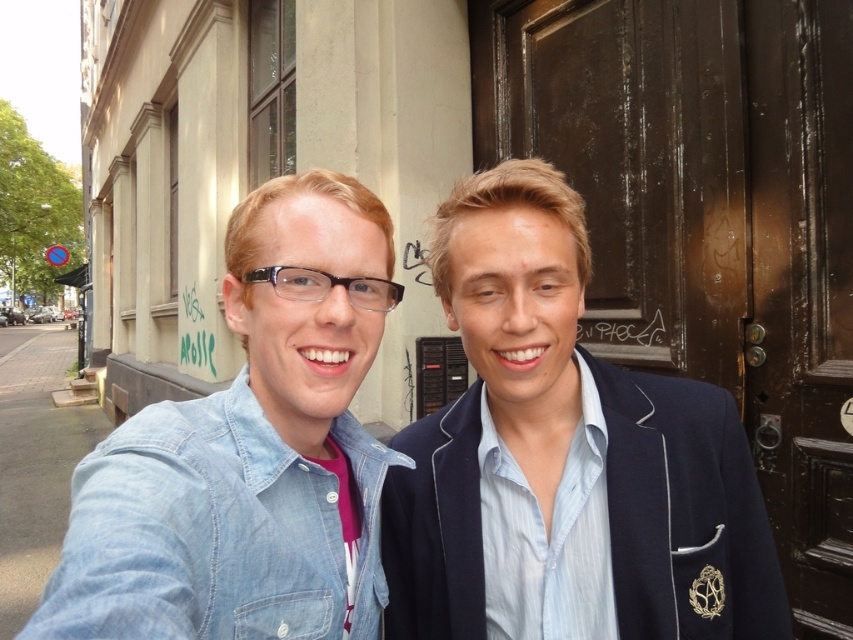
Does denim jacket at center have a greater width compared to denim jacket at lower left?

Indeed, denim jacket at center has a greater width compared to denim jacket at lower left.

Locate an element on the screen. The width and height of the screenshot is (853, 640). denim jacket at center is located at coordinates (564, 458).

The image size is (853, 640). I want to click on denim jacket at center, so click(564, 458).